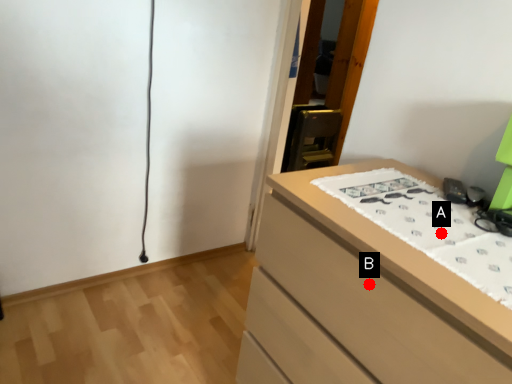
Question: Two points are circled on the image, labeled by A and B beside each circle. Which of the following is the closest to the observer?

Choices:
 (A) A is closer
 (B) B is closer

Answer: (B)